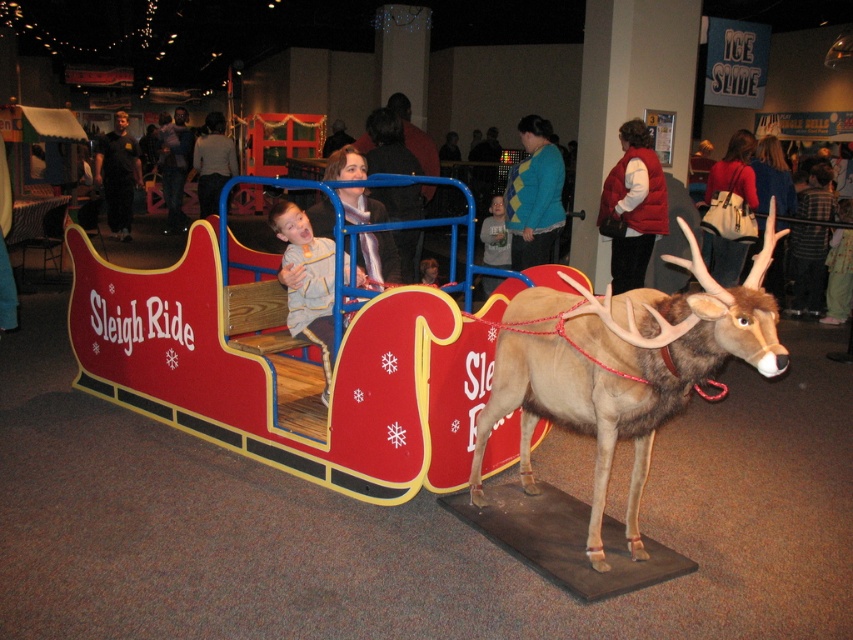
You are a costume designer preparing for a winter play. You need to determine which costume has a taller design between the red fleece vest at upper right and the teal sweater at center. Which one should you choose?

The red fleece vest at upper right has a greater height compared to the teal sweater at center, so you should choose the red fleece vest at upper right for a taller design.

You are a photographer at the holiday event and want to capture both the teal sweater at center and the matte gray sweater at center in a single photo. Which sweater should you focus on first to ensure both are in the frame?

You should focus on the teal sweater at center first because it is closer to you than the matte gray sweater at center, ensuring both will be in the frame.